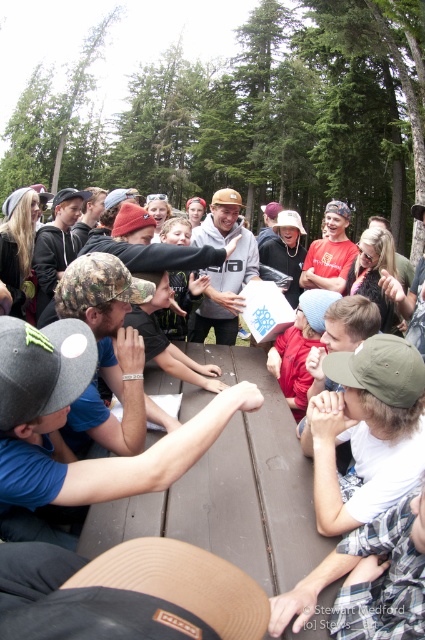
Question: Which of the following is the farthest from the observer?

Choices:
 (A) (221, 216)
 (B) (31, 451)

Answer: (A)

Question: Can you confirm if blue fabric cap at center is wider than matte gray hoodie at center?

Choices:
 (A) yes
 (B) no

Answer: (A)

Question: Which object is closer to the camera taking this photo?

Choices:
 (A) blue fabric cap at center
 (B) matte gray hoodie at center

Answer: (A)

Question: Considering the relative positions of blue fabric cap at center and matte gray hoodie at center in the image provided, where is blue fabric cap at center located with respect to matte gray hoodie at center?

Choices:
 (A) above
 (B) below

Answer: (B)

Question: Can you confirm if blue fabric cap at center is smaller than matte gray hoodie at center?

Choices:
 (A) yes
 (B) no

Answer: (A)